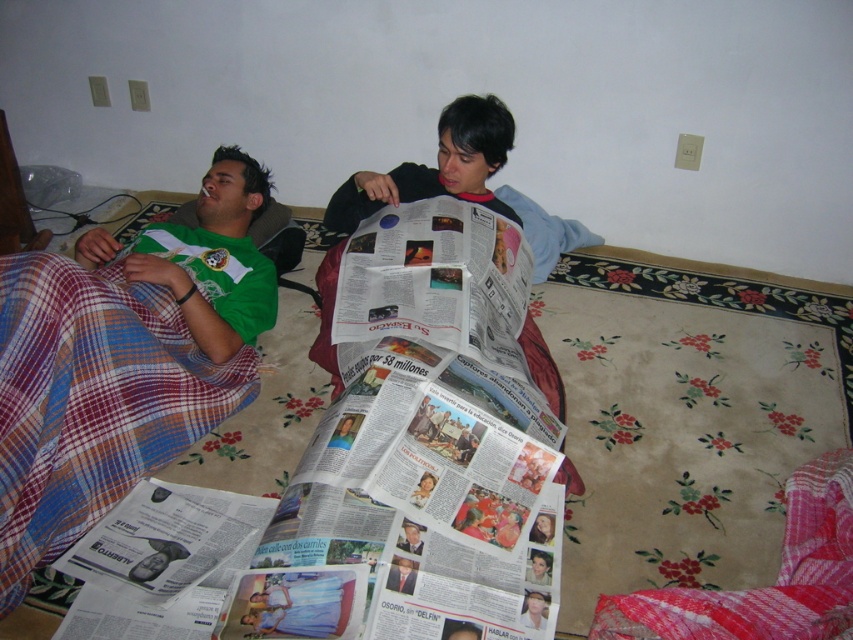
You are a delivery person who needs to place a small package between the green jersey at left and the printed paper newspaper at center on the bed. Which object should you place the package closer to in order to ensure it doesn

The green jersey at left is shorter than the printed paper newspaper at center, so placing the package closer to the printed paper newspaper at center would leave enough space between them.

You are a delivery person who needs to place a small package between the plaid fabric blanket at lower right and the green jersey at left on the bed. Can you fit it there?

The plaid fabric blanket at lower right is shorter than the green jersey at left, so the space between them may be limited. However, since the exact distance isn

You are a delivery person entering the room and need to place a package on the bed without disturbing the people. The package must be placed between the plaid fabric blanket at lower right and the green jersey at left. Is this possible?

The plaid fabric blanket at lower right is to the right of green jersey at left, so there is space between them where the package can be placed without disturbing the people.